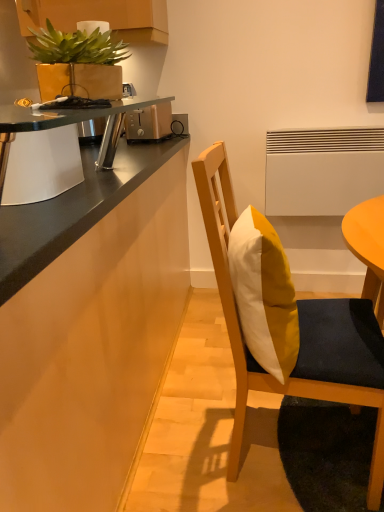
The height and width of the screenshot is (512, 384). In order to click on free space to the left of wooden chair with cushion at center in this screenshot , I will do `click(183, 438)`.